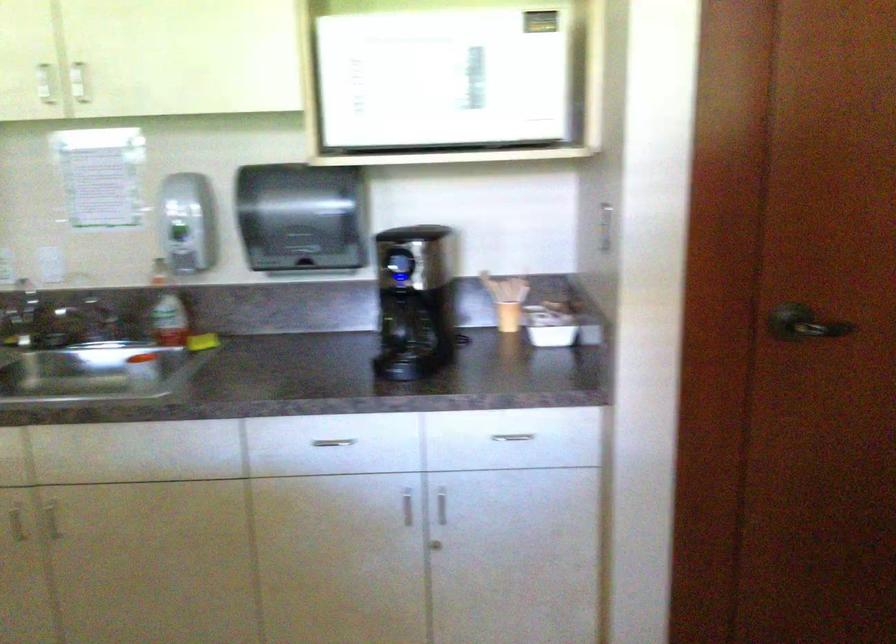
Image resolution: width=896 pixels, height=644 pixels. What do you see at coordinates (435, 545) in the screenshot? I see `the cabinet lock` at bounding box center [435, 545].